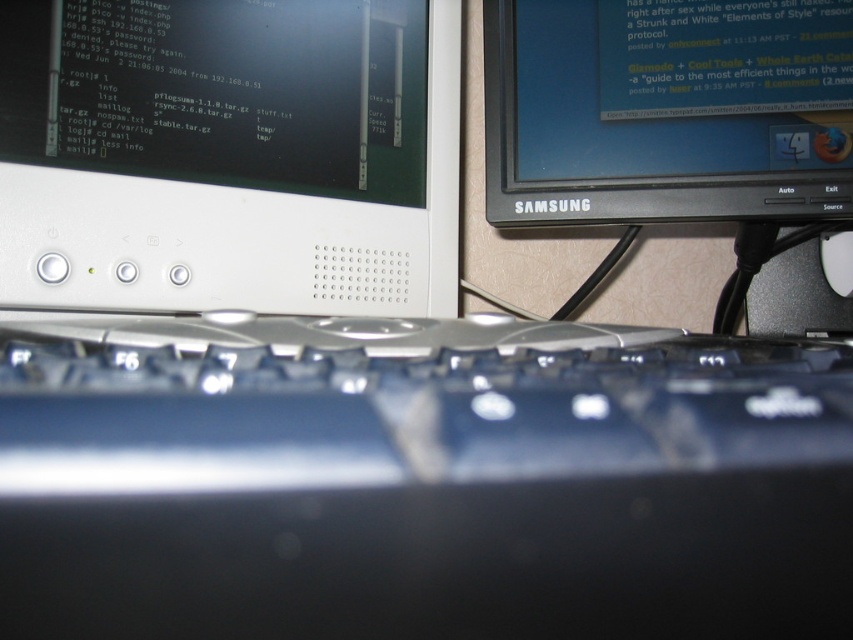
Is point (212, 163) in front of point (549, 0)?

Yes.

Who is shorter, white plastic monitor at upper center or black glossy monitor at upper right?

With less height is black glossy monitor at upper right.

Which is behind, point (62, 300) or point (548, 124)?

Positioned behind is point (548, 124).

Locate an element on the screen. white plastic monitor at upper center is located at coordinates tap(230, 154).

Does white plastic monitor at upper center have a smaller size compared to white plastic mouse at center?

No.

Is point (0, 122) positioned behind point (828, 250)?

No, (0, 122) is in front of (828, 250).

Is point (32, 108) positioned before point (844, 273)?

Yes, it is in front of point (844, 273).

Find the location of a particular element. white plastic monitor at upper center is located at coordinates (230, 154).

Who is shorter, black plastic keyboard at center or white plastic monitor at upper center?

Standing shorter between the two is black plastic keyboard at center.

Can you confirm if black plastic keyboard at center is taller than white plastic monitor at upper center?

Incorrect, black plastic keyboard at center's height is not larger of white plastic monitor at upper center's.

Between point (148, 604) and point (334, 156), which one is positioned in front?

Positioned in front is point (148, 604).

Where is `black plastic keyboard at center`? The height and width of the screenshot is (640, 853). black plastic keyboard at center is located at coordinates pos(418,477).